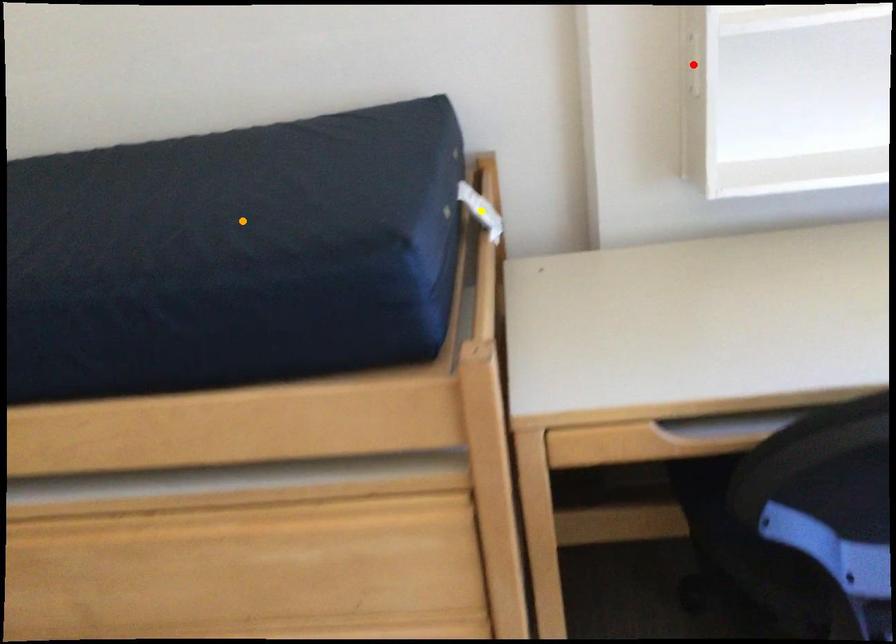
Order these from nearest to farthest:
1. orange point
2. red point
3. yellow point

orange point → yellow point → red point